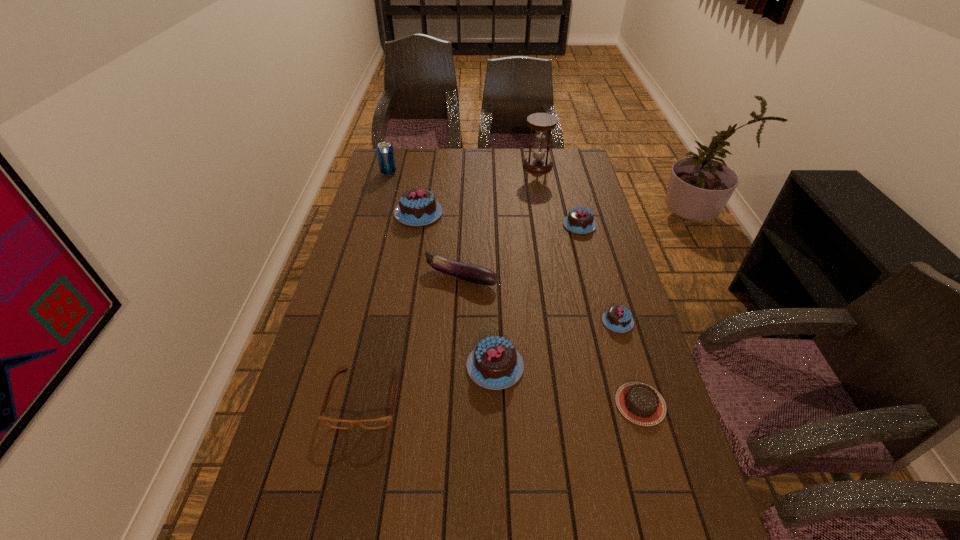
Locate an element on the screen. This screenshot has width=960, height=540. the tallest object is located at coordinates (541, 122).

The width and height of the screenshot is (960, 540). I want to click on blue beer can, so click(x=385, y=153).

At what (x,y) coordinates should I click in order to perform the action: click on beer can. Please return your answer as a coordinate pair (x, y). Looking at the image, I should click on (385, 153).

This screenshot has width=960, height=540. I want to click on the leftmost pink chocolate cake, so click(x=417, y=207).

Where is `the third tallest object`? the third tallest object is located at coordinates (417, 207).

Image resolution: width=960 pixels, height=540 pixels. I want to click on the third pink chocolate cake from right to left, so click(495, 364).

Where is `the fourth chocolate cake from right to left`? The width and height of the screenshot is (960, 540). the fourth chocolate cake from right to left is located at coordinates (495, 364).

The width and height of the screenshot is (960, 540). What are the coordinates of `the third shortest chocolate cake` in the screenshot? It's located at (580, 220).

Identify the location of purple eggplant. This screenshot has width=960, height=540. (474, 274).

Locate an element on the screen. eggplant is located at coordinates (474, 274).